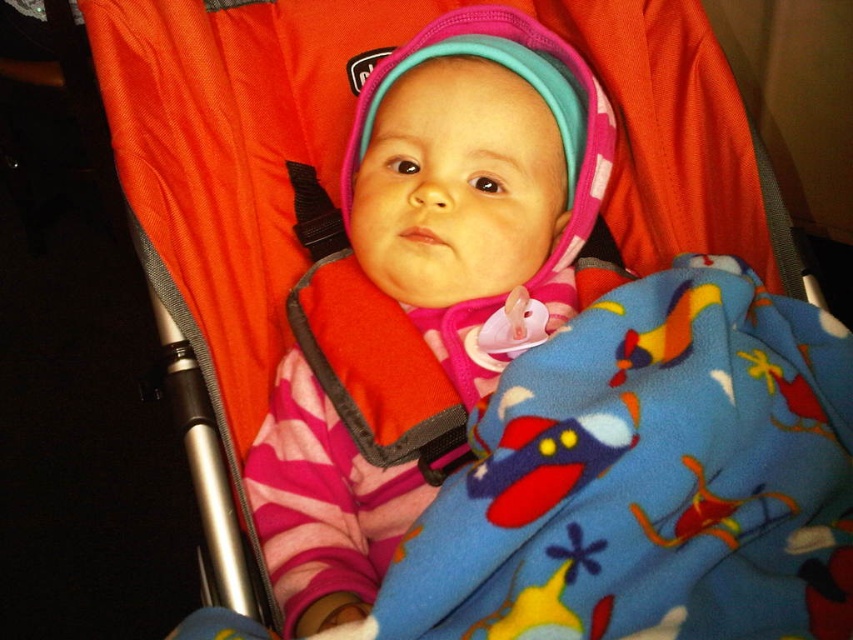
Can you confirm if blue fleece blanket at center is positioned below pink fleece baby at center?

Correct, blue fleece blanket at center is located below pink fleece baby at center.

Who is lower down, blue fleece blanket at center or pink fleece baby at center?

blue fleece blanket at center

Does point (572, 579) come behind point (450, 344)?

No, (572, 579) is in front of (450, 344).

Image resolution: width=853 pixels, height=640 pixels. What are the coordinates of `blue fleece blanket at center` in the screenshot? It's located at (647, 480).